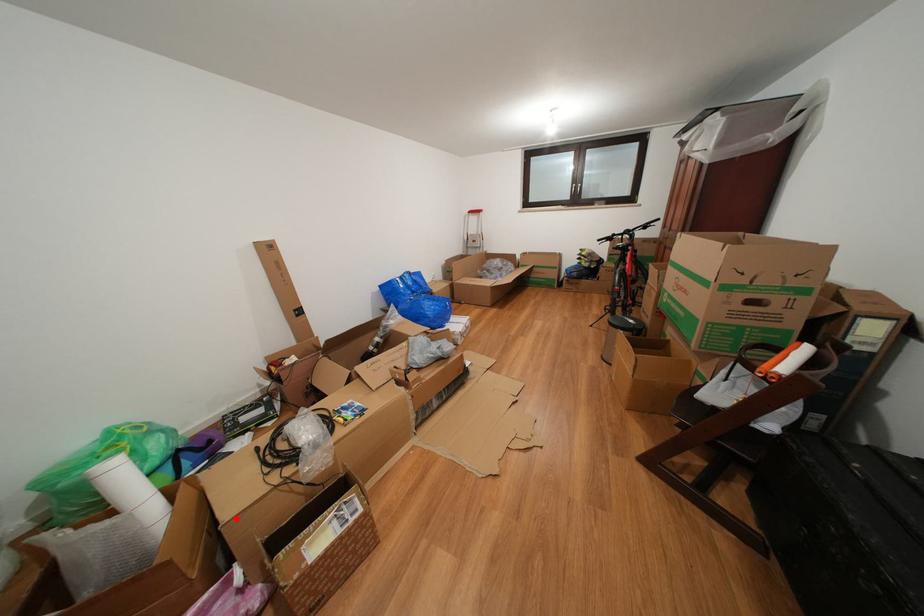
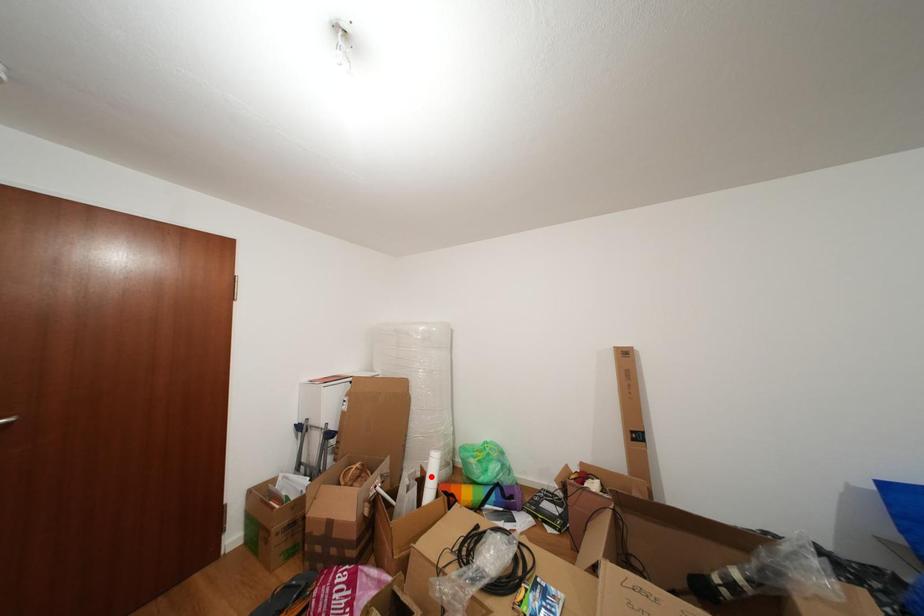
I am providing you with two images of the same scene from different viewpoints. A red point is marked on the first image and another point is marked on the second image. Does the point marked in image1 correspond to the same location as the one in image2?

No